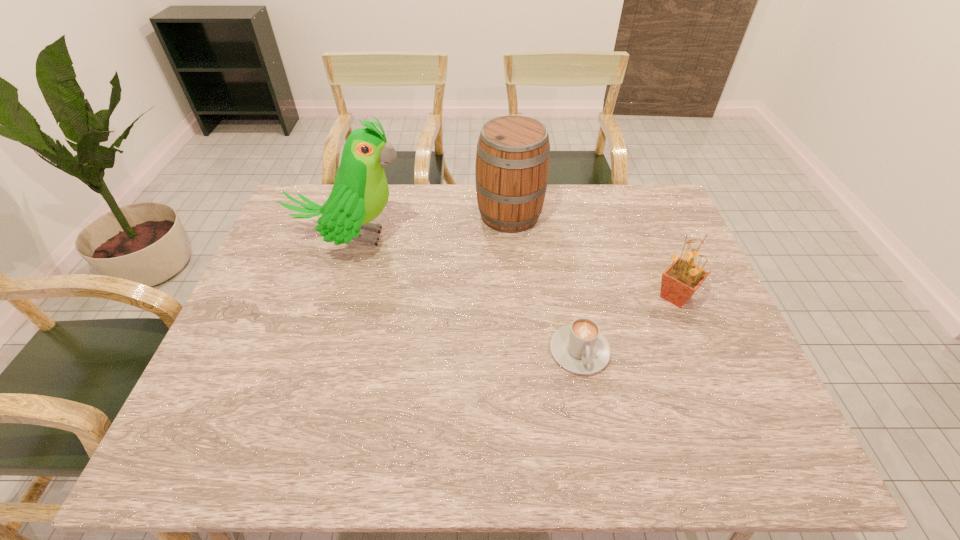
Identify the location of free space located at the front of the second shortest object with flowers visible. Image resolution: width=960 pixels, height=540 pixels. (631, 296).

Locate an element on the screen. Image resolution: width=960 pixels, height=540 pixels. blank space located at the front of the second shortest object with flowers visible is located at coordinates (519, 296).

Where is `vacant space located 0.200m to the right of the shortest object`? Image resolution: width=960 pixels, height=540 pixels. vacant space located 0.200m to the right of the shortest object is located at coordinates 601,464.

Identify the location of parakeet that is at the far edge. (360, 192).

The width and height of the screenshot is (960, 540). Identify the location of cider that is positioned at the far edge. (512, 164).

Where is `object at the left edge`? The width and height of the screenshot is (960, 540). object at the left edge is located at coordinates (360, 192).

This screenshot has width=960, height=540. Find the location of `object that is at the right edge`. object that is at the right edge is located at coordinates (682, 278).

Identify the location of object that is at the far left corner. (360, 192).

In the image, there is a desktop. Identify the location of free space at the far edge. The height and width of the screenshot is (540, 960). (583, 226).

The height and width of the screenshot is (540, 960). Find the location of `free location at the near edge`. free location at the near edge is located at coordinates (304, 440).